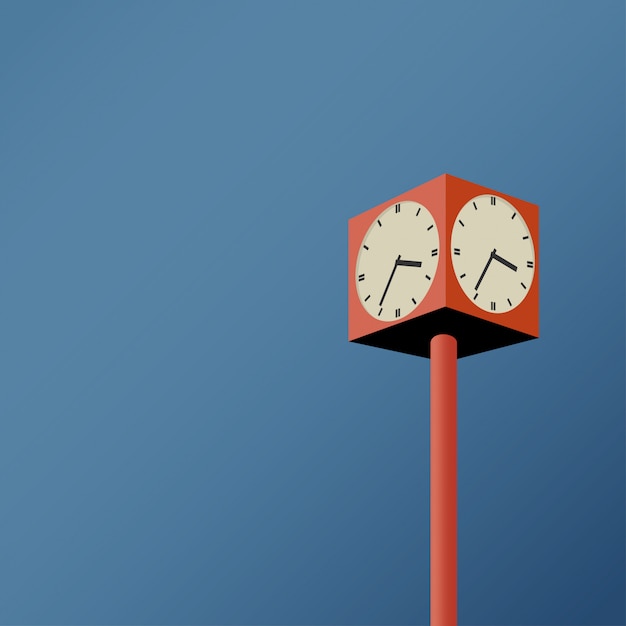
I want to click on right side of clock, so click(432, 304).